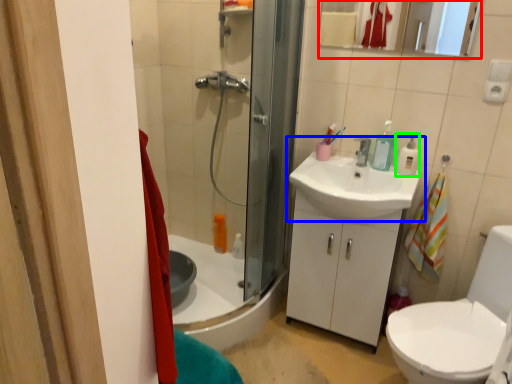
Question: Based on their relative distances, which object is nearer to mirror (highlighted by a red box)? Choose from sink (highlighted by a blue box) and soap dispenser (highlighted by a green box).

Choices:
 (A) sink
 (B) soap dispenser

Answer: (B)